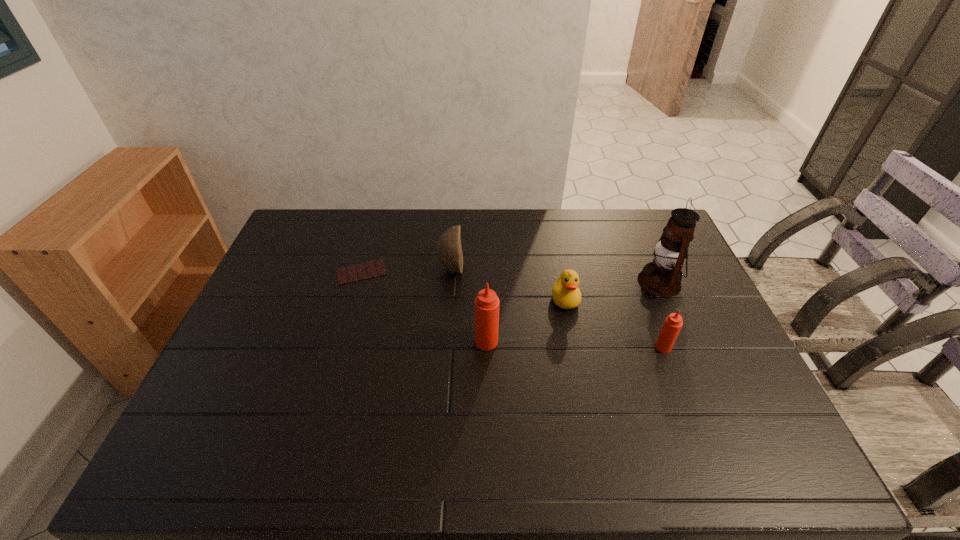
Where is `the second tallest object`? the second tallest object is located at coordinates (486, 305).

Locate an element on the screen. the left Tabasco sauce is located at coordinates (486, 305).

Locate an element on the screen. the shorter Tabasco sauce is located at coordinates (673, 323).

Locate an element on the screen. The height and width of the screenshot is (540, 960). the third object from right to left is located at coordinates (566, 294).

Where is `the second shortest object`? This screenshot has width=960, height=540. the second shortest object is located at coordinates (566, 294).

You are a GUI agent. You are given a task and a screenshot of the screen. Output one action in this format:
    pyautogui.click(x=<x>, y=<y>)
    Task: Click on the chocolate bar
    This screenshot has height=540, width=960.
    Given the screenshot: What is the action you would take?
    pyautogui.click(x=372, y=269)

I want to click on the shortest object, so tap(372, 269).

Find the location of `lantern`. lantern is located at coordinates point(662,277).

The height and width of the screenshot is (540, 960). In order to click on the second object from left to right in this screenshot , I will do `click(449, 249)`.

This screenshot has width=960, height=540. I want to click on free space located on the right of the left Tabasco sauce, so click(x=602, y=341).